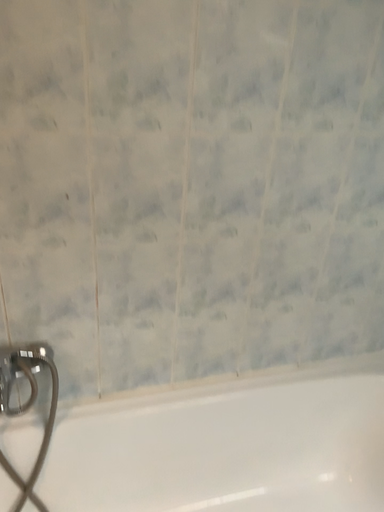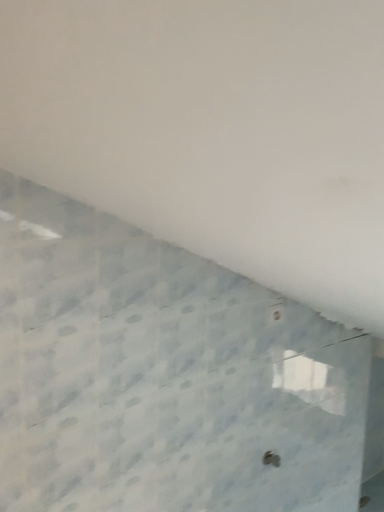
Question: How did the camera likely rotate when shooting the video?

Choices:
 (A) rotated downward
 (B) rotated upward

Answer: (B)